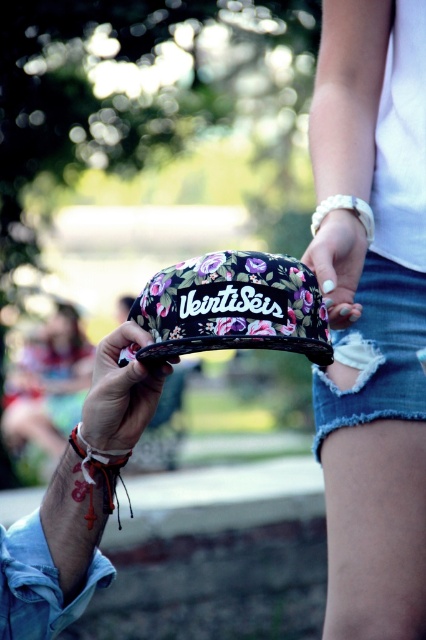
Question: Which of the following is the closest to the observer?

Choices:
 (A) (89, 509)
 (B) (106, 564)
 (C) (373, 298)

Answer: (A)

Question: Does denim shorts at lower right come behind floral-patterned fabric cap at lower center?

Choices:
 (A) no
 (B) yes

Answer: (B)

Question: Among these points, which one is farthest from the camera?

Choices:
 (A) (120, 374)
 (B) (46, 336)
 (C) (339, 429)
 (D) (51, 614)

Answer: (B)

Question: Which of the following is the farthest from the observer?

Choices:
 (A) floral-patterned fabric cap at lower center
 (B) floral-patterned fabric cap at lower left
 (C) white woven bracelet at center
 (D) denim shorts at lower right

Answer: (C)

Question: Is floral-patterned fabric baseball cap at center above floral fabric hand at center?

Choices:
 (A) yes
 (B) no

Answer: (B)

Question: Can you confirm if floral-patterned fabric baseball cap at center is positioned below white woven bracelet at center?

Choices:
 (A) yes
 (B) no

Answer: (A)